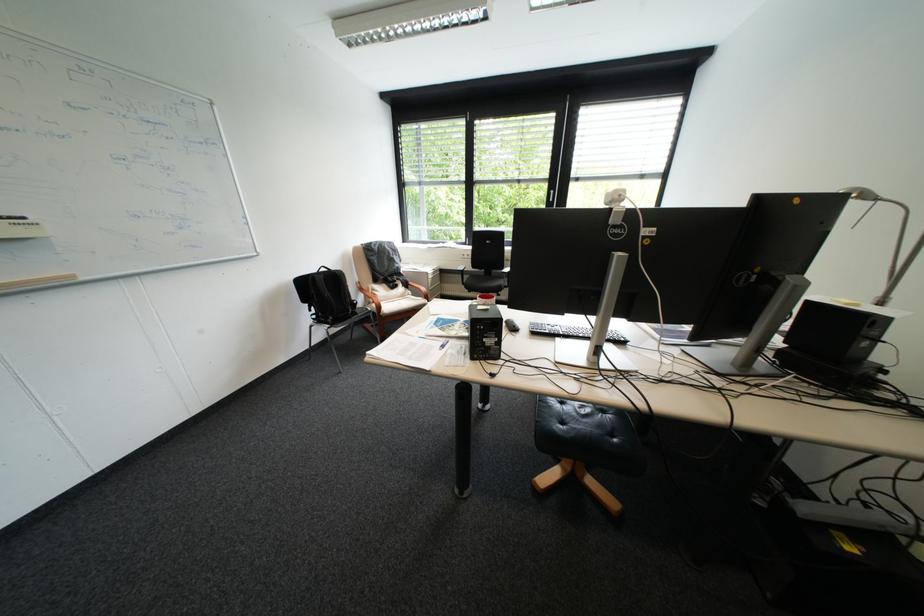
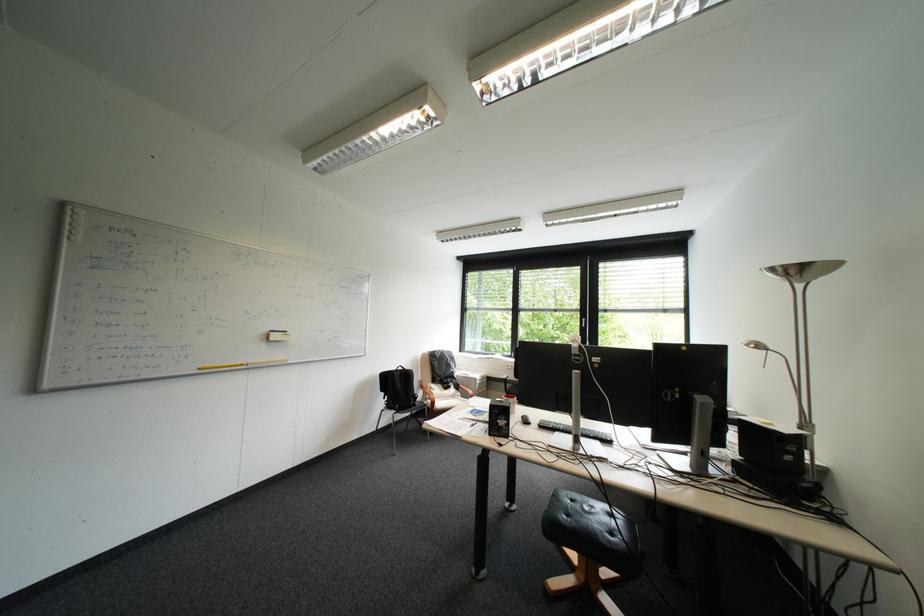
Question: The first image is from the beginning of the video and the second image is from the end. How did the camera likely rotate when shooting the video?

Choices:
 (A) Left
 (B) Right
 (C) Up
 (D) Down

Answer: (C)